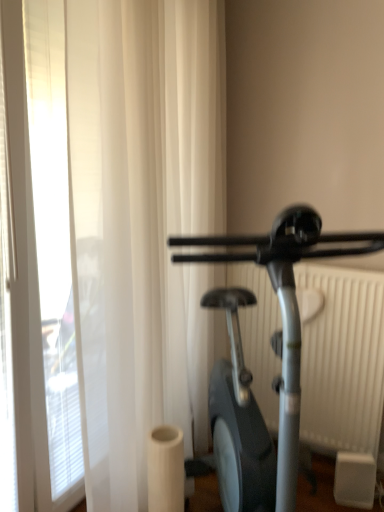
Question: Is white sheer curtain at left situated inside silver metallic stationary bicycle at right or outside?

Choices:
 (A) outside
 (B) inside

Answer: (A)

Question: From a real-world perspective, relative to silver metallic stationary bicycle at right, is white sheer curtain at left vertically above or below?

Choices:
 (A) above
 (B) below

Answer: (A)

Question: Which object is positioned farthest from the white sheer curtain at left?

Choices:
 (A) white plastic radiator at right
 (B) silver metallic stationary bicycle at right

Answer: (B)

Question: Which object is the farthest from the white plastic radiator at right?

Choices:
 (A) silver metallic stationary bicycle at right
 (B) white sheer curtain at left

Answer: (A)